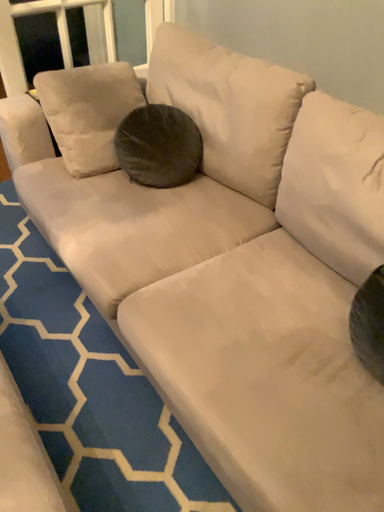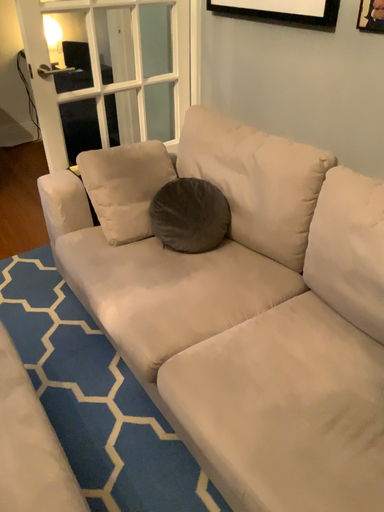
Question: How did the camera likely rotate when shooting the video?

Choices:
 (A) rotated upward
 (B) rotated downward

Answer: (A)